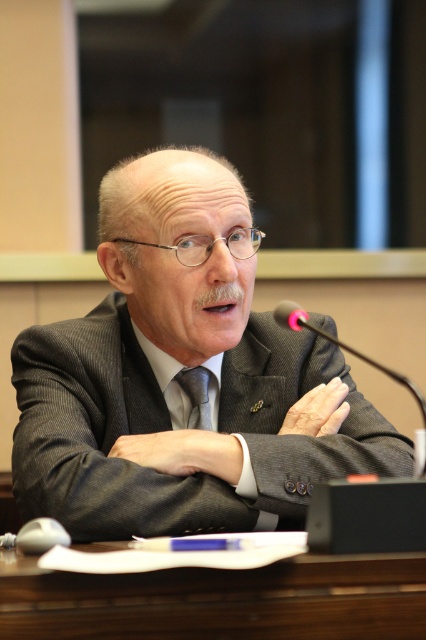
Question: Estimate the real-world distances between objects in this image. Which object is closer to the brown wooden table at center?

Choices:
 (A) silky gray tie at center
 (B) matte gray suit at center

Answer: (B)

Question: Which of the following is the closest to the observer?

Choices:
 (A) 203,371
 (B) 131,579
 (C) 321,440

Answer: (B)

Question: Is brown wooden table at center to the right of silky gray tie at center from the viewer's perspective?

Choices:
 (A) no
 (B) yes

Answer: (B)

Question: Is brown wooden table at center positioned behind silky gray tie at center?

Choices:
 (A) yes
 (B) no

Answer: (B)

Question: Estimate the real-world distances between objects in this image. Which object is closer to the brown wooden table at center?

Choices:
 (A) silky gray tie at center
 (B) matte gray suit at center

Answer: (B)

Question: Can you confirm if matte gray suit at center is positioned below silky gray tie at center?

Choices:
 (A) yes
 (B) no

Answer: (B)